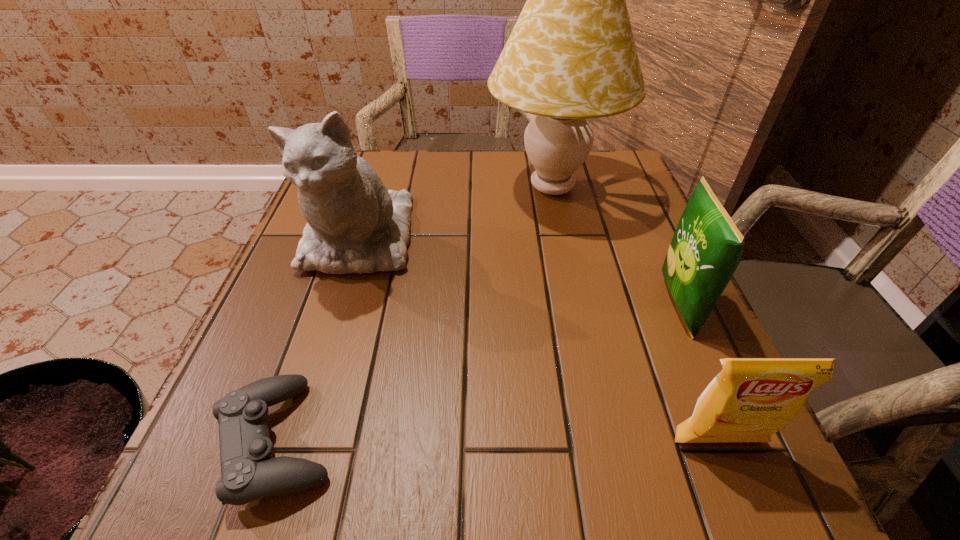
Identify which object is located as the fourth nearest to the nearer crisp (potato chip). Please provide its 2D coordinates. Your answer should be formatted as a tuple, i.e. [(x, y)], where the tuple contains the x and y coordinates of a point satisfying the conditions above.

[(354, 224)]

At what (x,y) coordinates should I click in order to perform the action: click on free space that satisfies the following two spatial constraints: 1. on the front-facing side of the farther crisp (potato chip); 2. on the front of the nearer crisp (potato chip) with the logo. Please return your answer as a coordinate pair (x, y). Looking at the image, I should click on (738, 442).

Where is `vacant space that satisfies the following two spatial constraints: 1. on the front-facing side of the farther crisp (potato chip); 2. on the front side of the control`? The image size is (960, 540). vacant space that satisfies the following two spatial constraints: 1. on the front-facing side of the farther crisp (potato chip); 2. on the front side of the control is located at coordinates (737, 441).

At what (x,y) coordinates should I click in order to perform the action: click on free space that satisfies the following two spatial constraints: 1. on the front-facing side of the farther crisp (potato chip); 2. on the front of the nearer crisp (potato chip) with the logo. Please return your answer as a coordinate pair (x, y). Image resolution: width=960 pixels, height=540 pixels. Looking at the image, I should click on (738, 442).